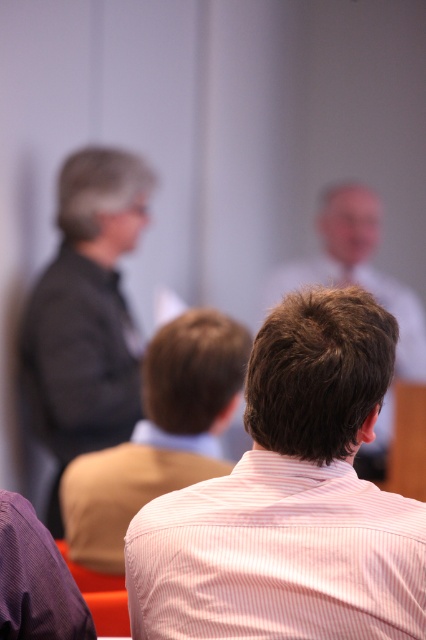
This screenshot has height=640, width=426. Identify the location of light brown shirt at center. (158, 435).

Between light brown shirt at center and light brown hair at center, which one is positioned lower?

light brown shirt at center is lower down.

Between point (176, 412) and point (334, 198), which one is positioned behind?

Point (334, 198)

Identify the location of light brown shirt at center. The image size is (426, 640). (158, 435).

Is point (150, 184) more distant than point (365, 211)?

No.

This screenshot has height=640, width=426. Identify the location of dark gray suit at left. (86, 314).

Is pink striped shirt at center bigger than light brown shirt at center?

Actually, pink striped shirt at center might be smaller than light brown shirt at center.

Does pink striped shirt at center have a smaller size compared to light brown shirt at center?

Yes.

What do you see at coordinates (290, 499) in the screenshot? I see `pink striped shirt at center` at bounding box center [290, 499].

Identify the location of pink striped shirt at center. The width and height of the screenshot is (426, 640). (290, 499).